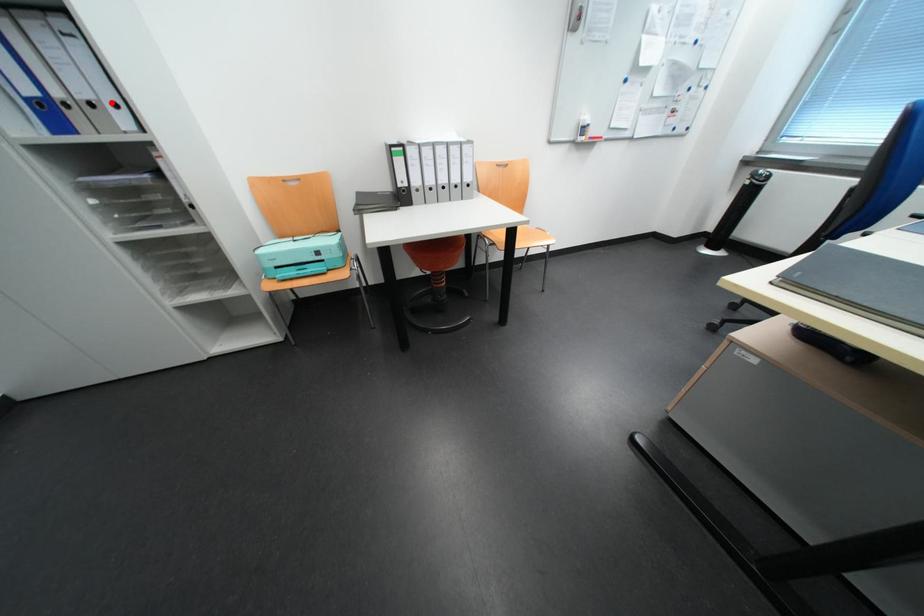
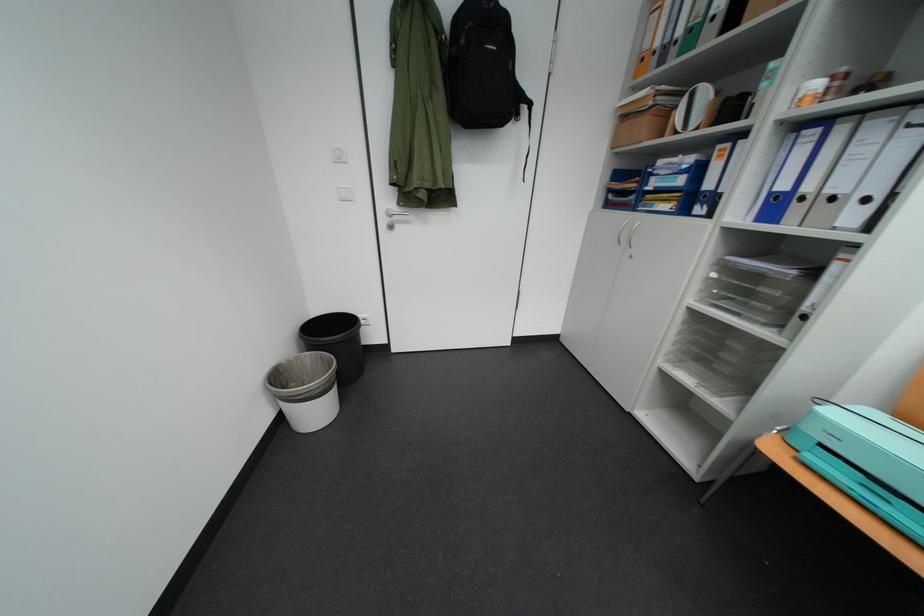
Question: I am providing you with two images of the same scene from different viewpoints. A red point is marked on the first image. At the location where the point appears in image 1, is it still visible in image 2?

Choices:
 (A) Yes
 (B) No

Answer: (A)